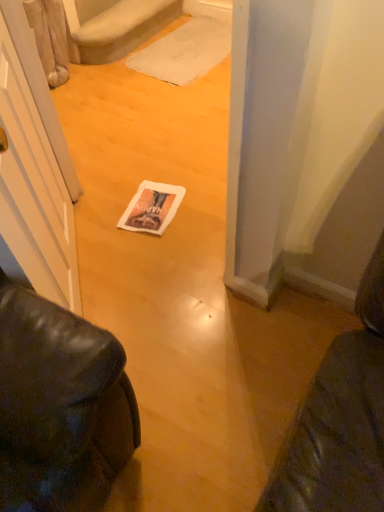
Consider the image. What is the approximate height of white plush carpet at upper center?

The height of white plush carpet at upper center is 8.73 inches.

You are a GUI agent. You are given a task and a screenshot of the screen. Output one action in this format:
    pyautogui.click(x=<x>, y=<y>)
    Task: Click on the white fabric doormat at center
    Image resolution: width=384 pixels, height=512 pixels.
    Given the screenshot: What is the action you would take?
    pyautogui.click(x=185, y=51)

Where is `white plush carpet at upper center`? white plush carpet at upper center is located at coordinates (116, 28).

From a real-world perspective, is white fabric doormat at center located higher than white plush carpet at upper center?

No, from a real-world perspective, white fabric doormat at center is not over white plush carpet at upper center

Which is closer to the camera, (223,48) or (84,52)?

Point (223,48) appears to be farther away from the viewer than point (84,52).

Is white fabric doormat at center touching white plush carpet at upper center?

No, white fabric doormat at center is not with white plush carpet at upper center.

Is white fabric doormat at center closer to camera compared to white plush carpet at upper center?

No, the depth of white fabric doormat at center is greater than that of white plush carpet at upper center.

Is white fabric doormat at center spatially inside white paper magazine at center, or outside of it?

white fabric doormat at center is spatially situated outside white paper magazine at center.

From a real-world perspective, between white fabric doormat at center and white paper magazine at center, who is vertically lower?

white paper magazine at center is physically lower.

Considering the relative sizes of white fabric doormat at center and white paper magazine at center in the image provided, is white fabric doormat at center taller than white paper magazine at center?

Yes, white fabric doormat at center is taller than white paper magazine at center.

In terms of width, does white fabric doormat at center look wider or thinner when compared to white paper magazine at center?

white fabric doormat at center is wider than white paper magazine at center.

From the image's perspective, between white paper magazine at center and white plush carpet at upper center, which one is located above?

white plush carpet at upper center is shown above in the image.

Which of these two, white paper magazine at center or white plush carpet at upper center, stands shorter?

With less height is white paper magazine at center.

Is white paper magazine at center bigger or smaller than white plush carpet at upper center?

In the image, white paper magazine at center appears to be smaller than white plush carpet at upper center.

At what (x,y) coordinates should I click in order to perform the action: click on doormat below the white plush carpet at upper center (from a real-world perspective). Please return your answer as a coordinate pair (x, y). Looking at the image, I should click on (185, 51).

Considering the positions of objects white plush carpet at upper center and white fabric doormat at center in the image provided, who is more to the left, white plush carpet at upper center or white fabric doormat at center?

white plush carpet at upper center.

Which is less distant, (x=89, y=33) or (x=219, y=53)?

The point (x=89, y=33) is closer to the camera.

What's the angular difference between white plush carpet at upper center and white fabric doormat at center's facing directions?

4.1 degrees separate the facing orientations of white plush carpet at upper center and white fabric doormat at center.

Which is correct: white paper magazine at center is inside white fabric doormat at center, or outside of it?

white paper magazine at center cannot be found inside white fabric doormat at center.

Between white paper magazine at center and white fabric doormat at center, which one has less height?

With less height is white paper magazine at center.

Which object is positioned more to the right, white paper magazine at center or white fabric doormat at center?

white fabric doormat at center.

Considering the relative sizes of white plush carpet at upper center and white paper magazine at center in the image provided, is white plush carpet at upper center wider than white paper magazine at center?

In fact, white plush carpet at upper center might be narrower than white paper magazine at center.

Can you confirm if white plush carpet at upper center is taller than white paper magazine at center?

Yes.

Could you tell me if white plush carpet at upper center is turned towards white paper magazine at center?

No, white plush carpet at upper center is not aimed at white paper magazine at center.

From a real-world perspective, between white plush carpet at upper center and white paper magazine at center, who is vertically higher?

white plush carpet at upper center.

This screenshot has height=512, width=384. Find the location of `doormat below the white plush carpet at upper center (from the image's perspective)`. doormat below the white plush carpet at upper center (from the image's perspective) is located at coordinates (185, 51).

Locate an element on the screen. Image resolution: width=384 pixels, height=512 pixels. magazine lying on the left of white fabric doormat at center is located at coordinates (152, 208).

Considering their positions, is white fabric doormat at center positioned further to white plush carpet at upper center than white paper magazine at center?

Among the two, white paper magazine at center is located further to white plush carpet at upper center.

From the image, which object appears to be nearer to white fabric doormat at center, white paper magazine at center or white plush carpet at upper center?

Among the two, white plush carpet at upper center is located nearer to white fabric doormat at center.

From the image, which object appears to be nearer to white paper magazine at center, white plush carpet at upper center or white fabric doormat at center?

white fabric doormat at center.

In the scene shown: Estimate the real-world distances between objects in this image. Which object is further from white fabric doormat at center, white plush carpet at upper center or white paper magazine at center?

white paper magazine at center is positioned further to the anchor white fabric doormat at center.

Estimate the real-world distances between objects in this image. Which object is further from white plush carpet at upper center, white paper magazine at center or white fabric doormat at center?

white paper magazine at center is further to white plush carpet at upper center.

Based on their spatial positions, is white fabric doormat at center or white plush carpet at upper center further from white paper magazine at center?

white plush carpet at upper center is further to white paper magazine at center.

This screenshot has width=384, height=512. Find the location of `doormat between white plush carpet at upper center and white paper magazine at center vertically`. doormat between white plush carpet at upper center and white paper magazine at center vertically is located at coordinates (185, 51).